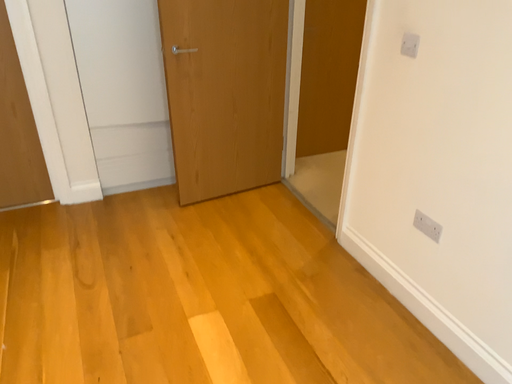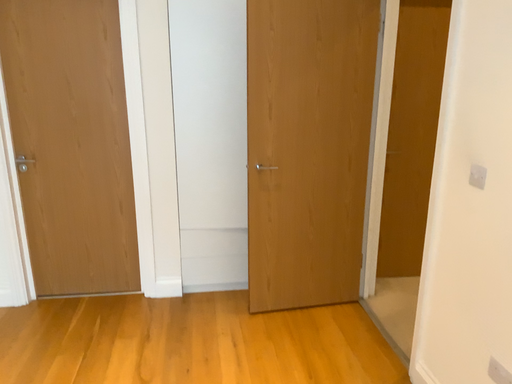
Question: How did the camera likely rotate when shooting the video?

Choices:
 (A) rotated left
 (B) rotated right

Answer: (A)